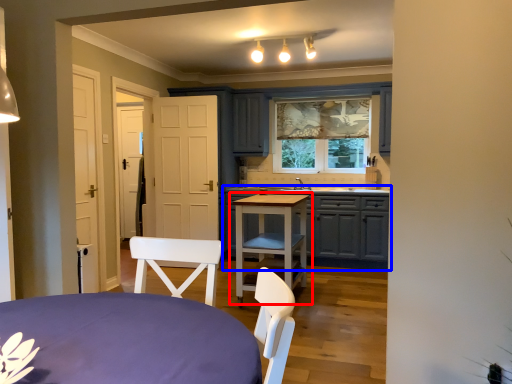
Question: Which of the following is the closest to the observer, table (highlighted by a red box) or cabinetry (highlighted by a blue box)?

Choices:
 (A) table
 (B) cabinetry

Answer: (A)